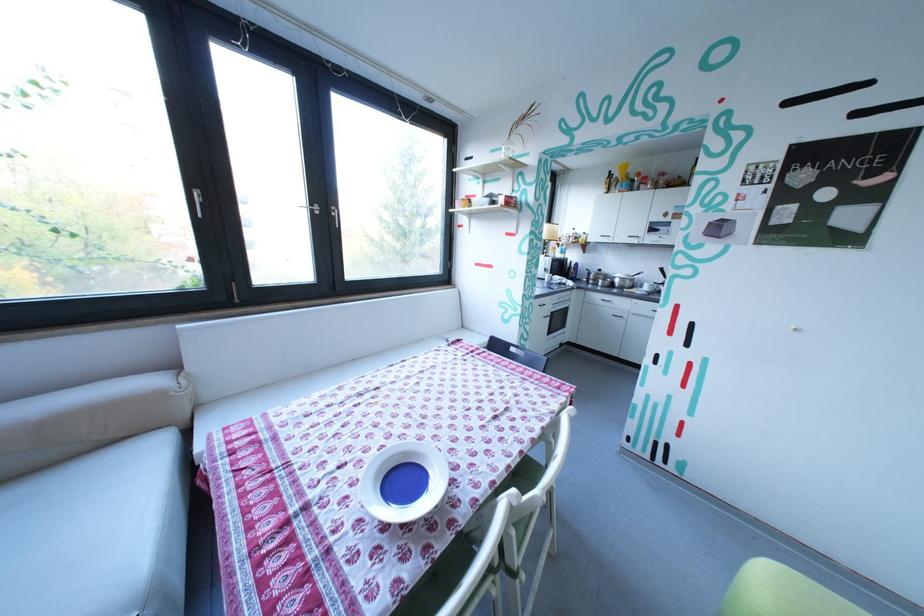
The image size is (924, 616). In order to click on chair sitting surface in this screenshot , I will do `click(546, 476)`.